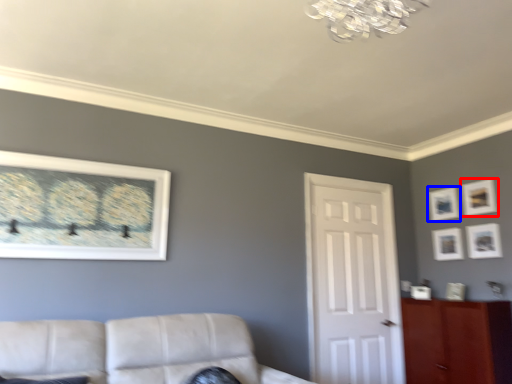
Question: Which object appears closest to the camera in this image, picture frame (highlighted by a red box) or picture frame (highlighted by a blue box)?

Choices:
 (A) picture frame
 (B) picture frame

Answer: (A)